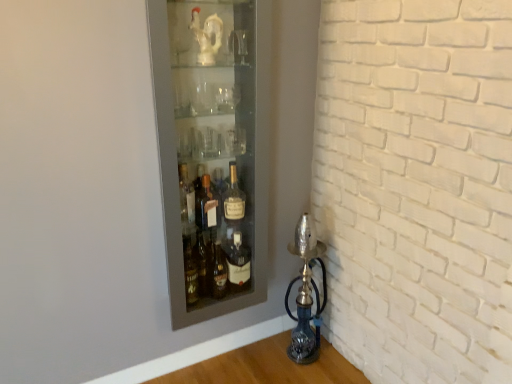
Question: Would you say matte glass bottle at center is inside or outside matte glass cabinet at upper left?

Choices:
 (A) outside
 (B) inside

Answer: (B)

Question: From a real-world perspective, relative to matte glass cabinet at upper left, is matte glass bottle at center vertically above or below?

Choices:
 (A) below
 (B) above

Answer: (A)

Question: Which object is positioned farthest from the matte glass bottle at center?

Choices:
 (A) blue glass oil lamp at lower right
 (B) matte glass cabinet at upper left

Answer: (A)

Question: Which of these objects is positioned farthest from the matte glass bottle at center?

Choices:
 (A) blue glass oil lamp at lower right
 (B) matte glass cabinet at upper left

Answer: (A)